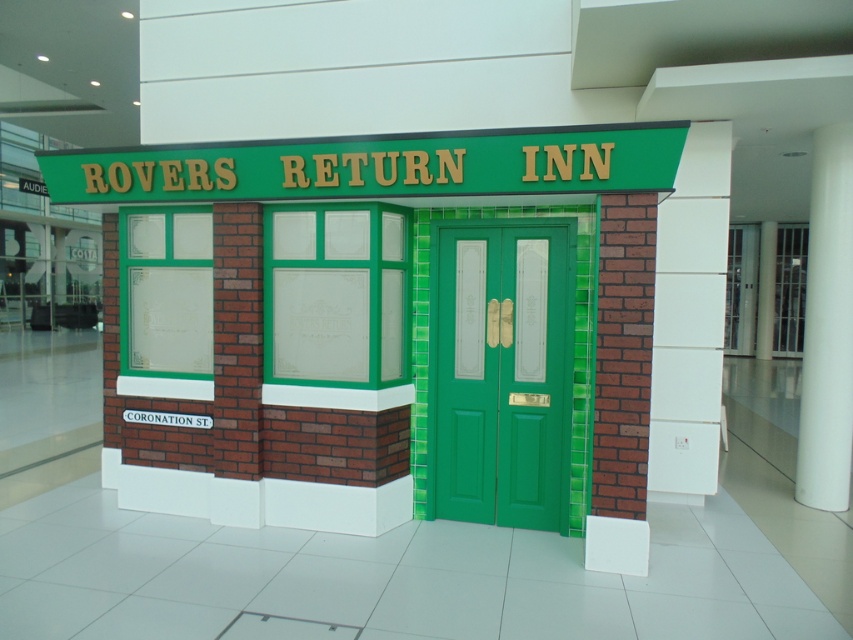
Who is positioned more to the right, green painted wood door at center or green painted wood sign at upper center?

green painted wood door at center

Who is higher up, green painted wood door at center or green painted wood sign at upper center?

green painted wood sign at upper center is above.

Is point (494, 355) closer to camera compared to point (215, 150)?

No, it is not.

Identify the location of green painted wood door at center. Image resolution: width=853 pixels, height=640 pixels. (503, 372).

Is green painted wood sign at upper center to the right of white smooth pillar at right from the viewer's perspective?

No, green painted wood sign at upper center is not to the right of white smooth pillar at right.

Between point (553, 168) and point (824, 152), which one is positioned in front?

Point (553, 168)

Find the location of a particular element. green painted wood sign at upper center is located at coordinates (375, 164).

Where is `green painted wood sign at upper center`? The image size is (853, 640). green painted wood sign at upper center is located at coordinates (375, 164).

Is green painted wood door at center wider than white smooth pillar at right?

Indeed, green painted wood door at center has a greater width compared to white smooth pillar at right.

Does point (543, 355) come closer to viewer compared to point (825, 225)?

Yes, point (543, 355) is closer to viewer.

Locate an element on the screen. The width and height of the screenshot is (853, 640). green painted wood door at center is located at coordinates (503, 372).